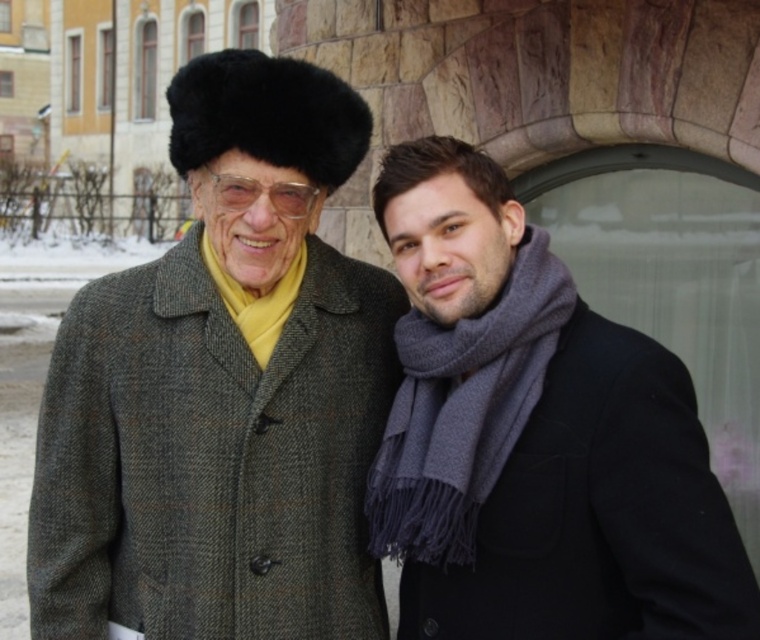
Question: Can you confirm if textured wool coat at center is positioned to the left of transparent plastic glasses at center?

Choices:
 (A) no
 (B) yes

Answer: (B)

Question: Does textured wool coat at center appear under gray woolen scarf at right?

Choices:
 (A) yes
 (B) no

Answer: (A)

Question: Among these points, which one is farthest from the camera?

Choices:
 (A) (410, 355)
 (B) (43, 502)
 (C) (230, 70)
 (D) (486, 552)

Answer: (B)

Question: Which point appears closest to the camera in this image?

Choices:
 (A) (290, 200)
 (B) (280, 61)
 (C) (97, 285)

Answer: (A)

Question: Among these points, which one is farthest from the camera?

Choices:
 (A) (603, 445)
 (B) (404, 339)

Answer: (B)

Question: Can you confirm if textured wool coat at center is wider than transparent plastic glasses at center?

Choices:
 (A) no
 (B) yes

Answer: (B)